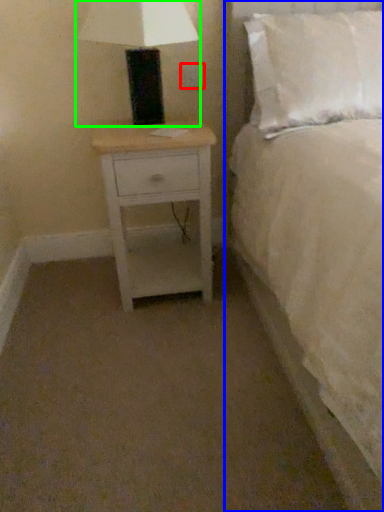
Question: Which object is the closest to the electric outlet (highlighted by a red box)? Choose among these: bed (highlighted by a blue box) or table lamp (highlighted by a green box).

Choices:
 (A) bed
 (B) table lamp

Answer: (B)